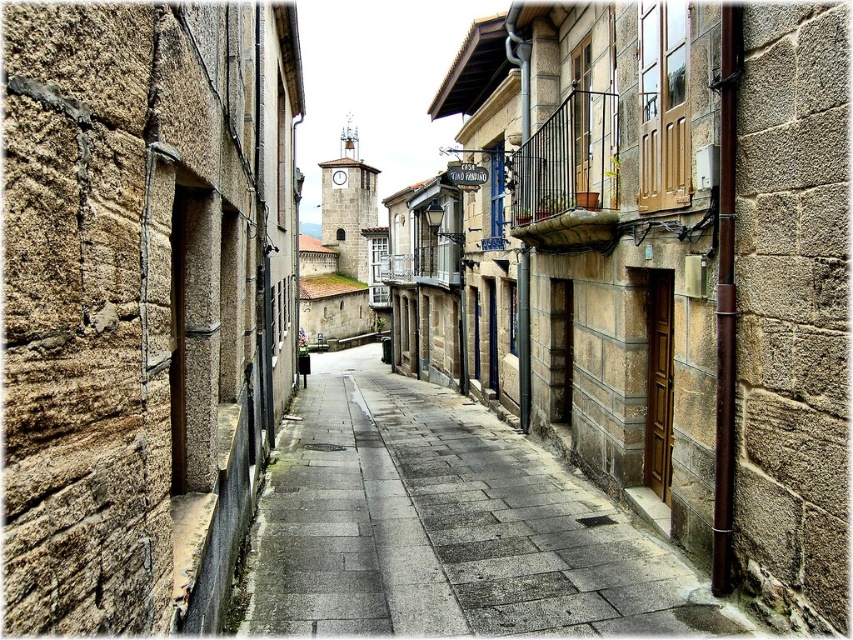
Question: Is rough stone wall at left above gray stone pavement at center?

Choices:
 (A) yes
 (B) no

Answer: (A)

Question: Which object is closer to the camera taking this photo?

Choices:
 (A) gray stone pavement at center
 (B) rough stone wall at left

Answer: (B)

Question: Can you confirm if rough stone wall at left is positioned to the right of gray stone pavement at center?

Choices:
 (A) yes
 (B) no

Answer: (B)

Question: Does rough stone wall at left have a lesser width compared to gray stone pavement at center?

Choices:
 (A) no
 (B) yes

Answer: (B)

Question: Which of the following is the closest to the observer?

Choices:
 (A) click(200, 355)
 (B) click(340, 522)

Answer: (A)